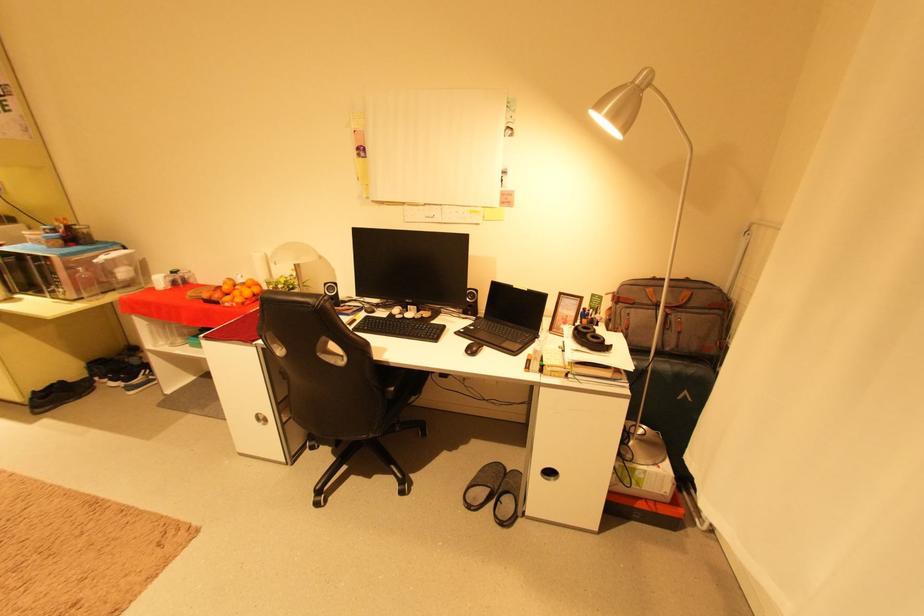
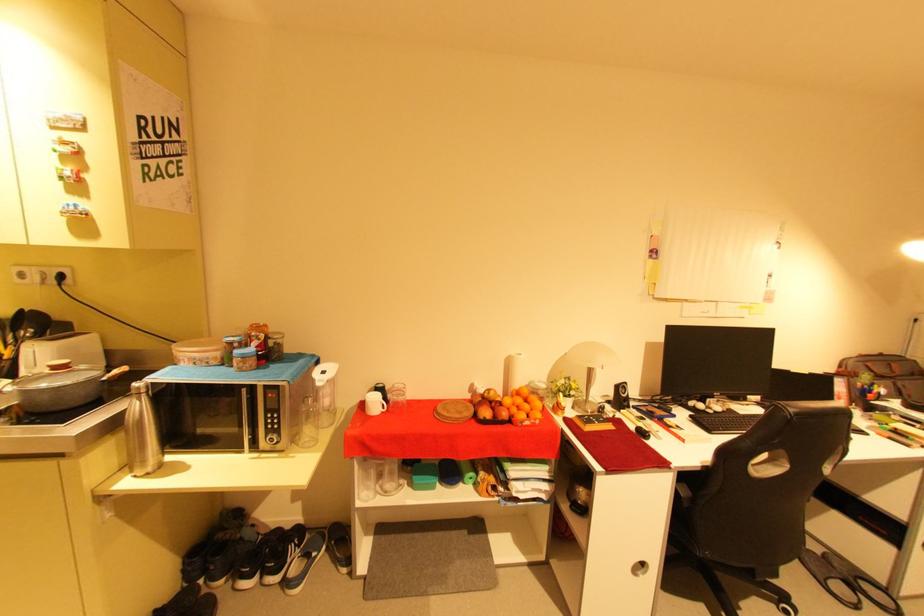
Where in the second image is the point corresponding to point 420,318 from the first image?

(730, 411)